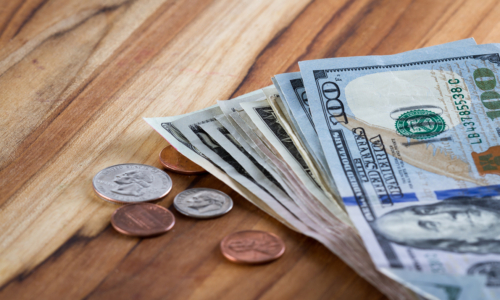
Where is `color changes in wood surface`? Image resolution: width=500 pixels, height=300 pixels. color changes in wood surface is located at coordinates (452, 23), (411, 24), (319, 30), (245, 41).